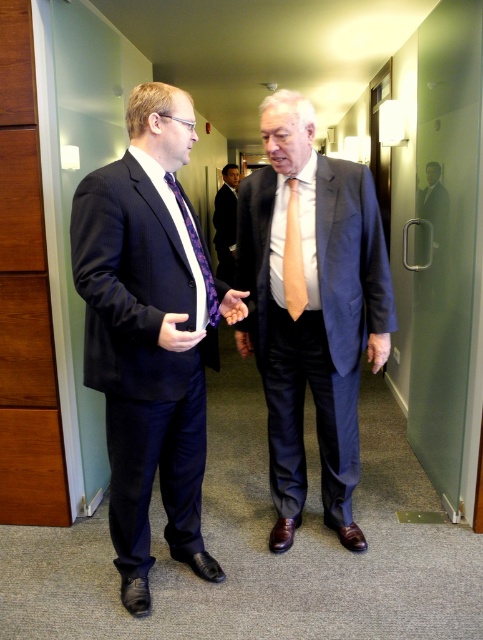
In the scene shown: Who is more distant from viewer, (111, 305) or (183, 204)?

Point (183, 204)

Is matte black suit at left wider than purple satin tie at center?

Indeed, matte black suit at left has a greater width compared to purple satin tie at center.

Is point (139, 406) behind point (213, 301)?

No, it is not.

What are the coordinates of `matte black suit at left` in the screenshot? It's located at (147, 333).

Is matte black suit at center positioned at the back of smooth orange hand at center?

Yes, it is behind smooth orange hand at center.

Does point (215, 211) come in front of point (232, 305)?

No, (215, 211) is behind (232, 305).

You are a GUI agent. You are given a task and a screenshot of the screen. Output one action in this format:
    pyautogui.click(x=<x>, y=<y>)
    Task: Click on the matte black suit at center
    This screenshot has width=483, height=640.
    Given the screenshot: What is the action you would take?
    pyautogui.click(x=226, y=224)

Who is higher up, matte black suit at left or smooth orange hand at center?

smooth orange hand at center is higher up.

Who is more distant from viewer, (202, 246) or (240, 301)?

Positioned behind is point (240, 301).

The image size is (483, 640). In order to click on matte black suit at left in this screenshot , I will do `click(147, 333)`.